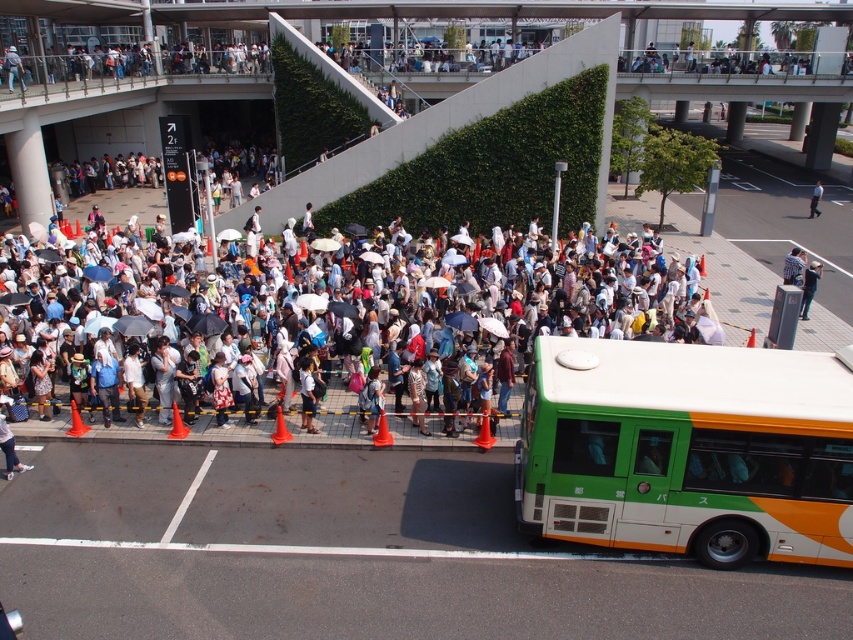
Which is below, matte white crowd at center or white fabric shirt at center?

matte white crowd at center

Does matte white crowd at center appear on the left side of white fabric shirt at center?

Correct, you'll find matte white crowd at center to the left of white fabric shirt at center.

The image size is (853, 640). Identify the location of matte white crowd at center. (540, 316).

From the picture: Is matte white crowd at center further to the viewer compared to light blue fabric jacket at center?

No, it is in front of light blue fabric jacket at center.

Does matte white crowd at center appear under light blue fabric jacket at center?

No.

Identify the location of matte white crowd at center. (540, 316).

Can you confirm if green matte bus at lower right is bigger than white fabric shirt at center?

Incorrect, green matte bus at lower right is not larger than white fabric shirt at center.

Can you confirm if green matte bus at lower right is taller than white fabric shirt at center?

No.

Who is more forward, (780, 401) or (811, 204)?

Point (780, 401)

Where is `green matte bus at lower right`? Image resolution: width=853 pixels, height=640 pixels. green matte bus at lower right is located at coordinates (688, 451).